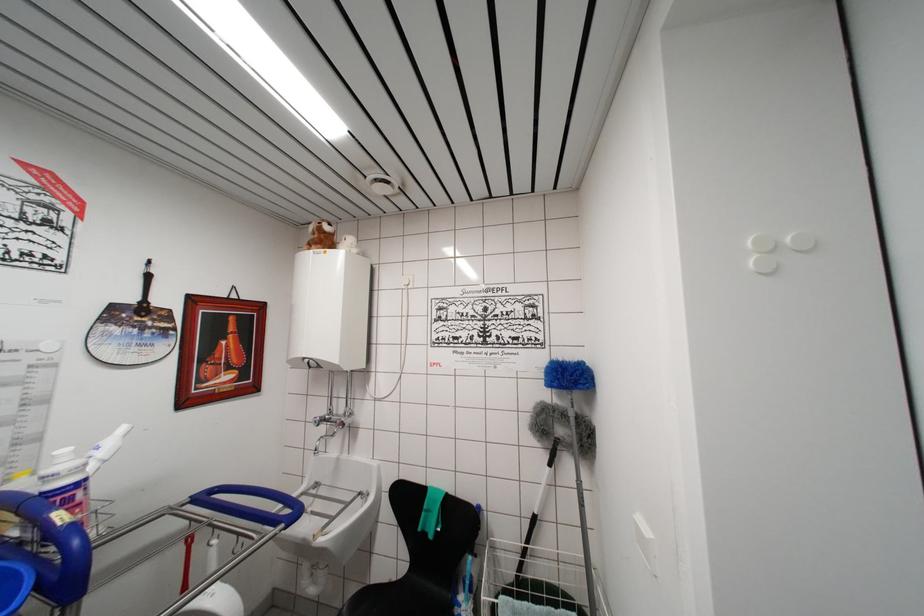
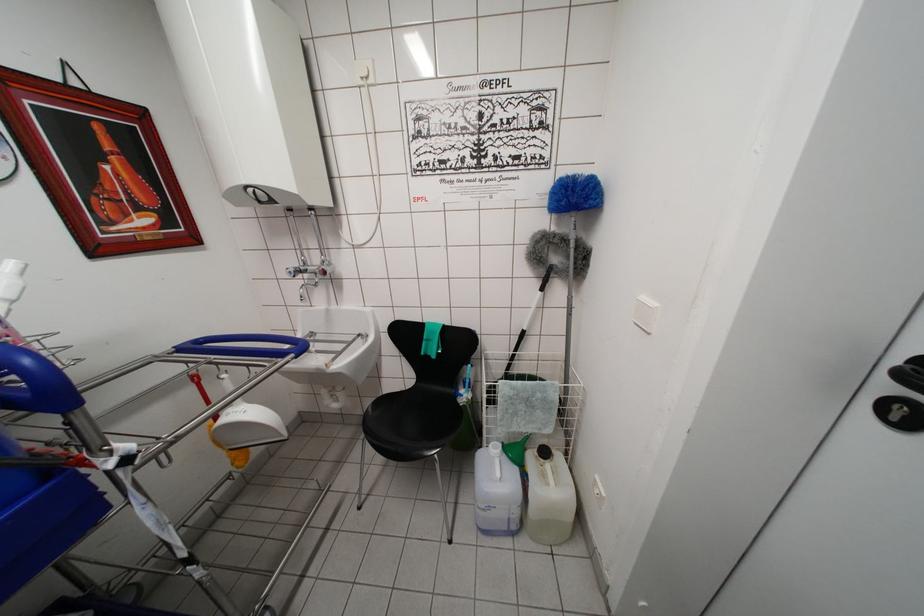
Where in the second image is the point corresponding to [322,445] from the first image?

(305, 292)